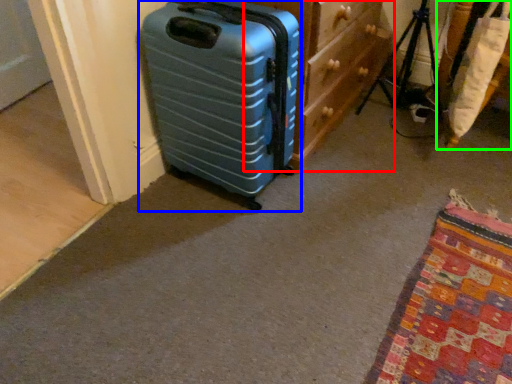
Question: Based on their relative distances, which object is farther from dresser (highlighted by a red box)? Choose from suitcase (highlighted by a blue box) and furniture (highlighted by a green box).

Choices:
 (A) suitcase
 (B) furniture

Answer: (B)